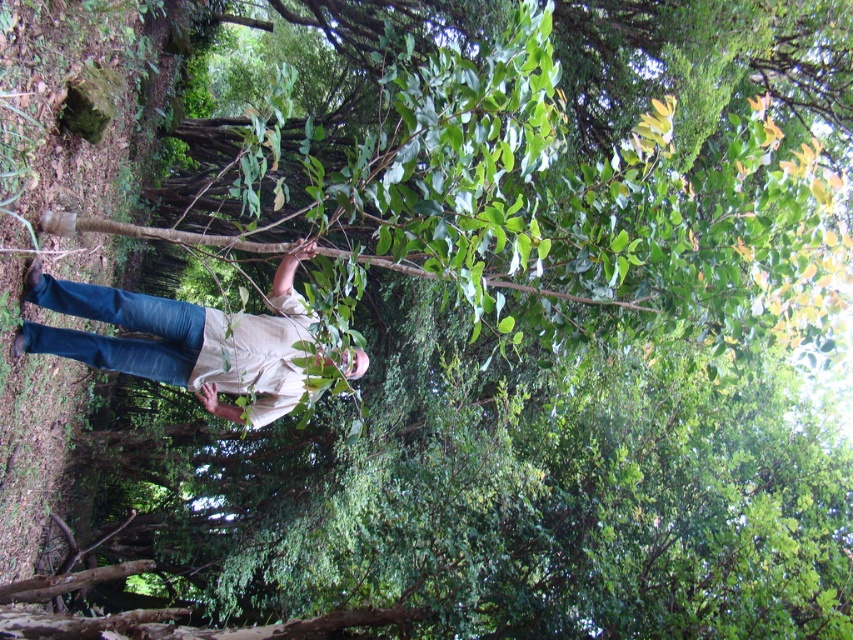
Question: Which object appears closest to the camera in this image?

Choices:
 (A) denim jeans at lower left
 (B) brown rough tree branch at center

Answer: (B)

Question: Is the position of denim jeans at lower left more distant than that of brown rough tree branch at center?

Choices:
 (A) yes
 (B) no

Answer: (A)

Question: Considering the relative positions of denim jeans at lower left and brown rough tree branch at center in the image provided, where is denim jeans at lower left located with respect to brown rough tree branch at center?

Choices:
 (A) left
 (B) right

Answer: (A)

Question: Which of the following is the farthest from the observer?

Choices:
 (A) denim jeans at lower left
 (B) brown rough tree branch at center

Answer: (A)

Question: Is denim jeans at lower left positioned at the back of brown rough tree branch at center?

Choices:
 (A) no
 (B) yes

Answer: (B)